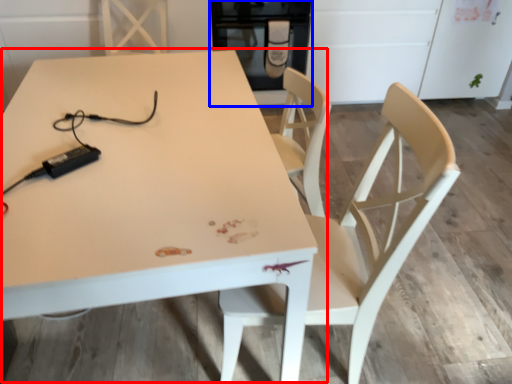
Question: Which object appears closest to the camera in this image, table (highlighted by a red box) or appliance (highlighted by a blue box)?

Choices:
 (A) table
 (B) appliance

Answer: (A)